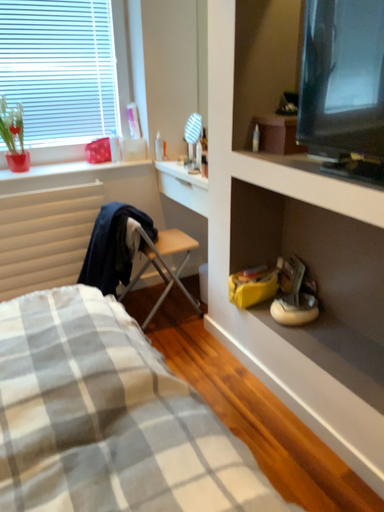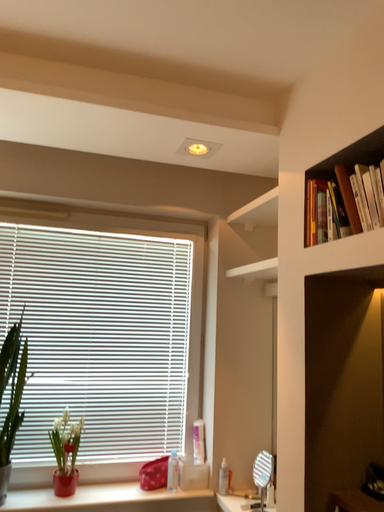
Question: Which way did the camera rotate in the video?

Choices:
 (A) rotated downward
 (B) rotated upward

Answer: (B)